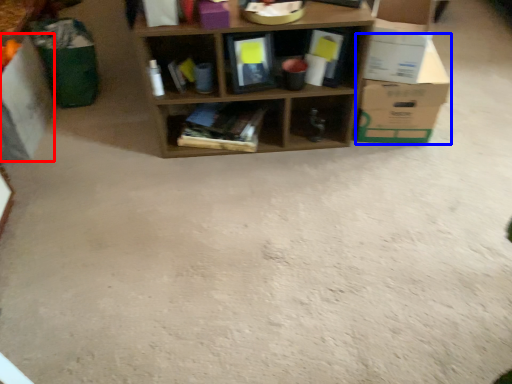
Question: Among these objects, which one is farthest to the camera, cardboard box (highlighted by a red box) or cardboard box (highlighted by a blue box)?

Choices:
 (A) cardboard box
 (B) cardboard box

Answer: (B)